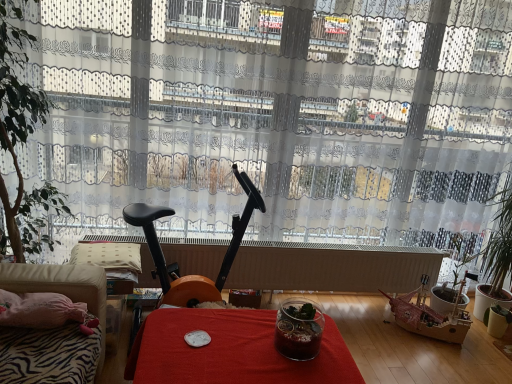
Where is `black plastic exercise bike at center`? black plastic exercise bike at center is located at coordinates (176, 263).

Locate an element on the screen. green leafy plant at right, which is the first houseplant from right to left is located at coordinates (455, 277).

The height and width of the screenshot is (384, 512). Describe the element at coordinates (16, 114) in the screenshot. I see `green leafy plant at left, acting as the first houseplant starting from the top` at that location.

Describe the element at coordinates (231, 351) in the screenshot. I see `red fabric table at center` at that location.

What do you see at coordinates (298, 329) in the screenshot?
I see `transparent glass jar at center` at bounding box center [298, 329].

What are the coordinates of `black plastic exercise bike at center` in the screenshot? It's located at (176, 263).

Which of these two, black plastic exercise bike at center or green leafy plant at left, acting as the first houseplant starting from the top, stands shorter?

black plastic exercise bike at center is shorter.

Is black plastic exercise bike at center positioned before green leafy plant at left, which is the 1th houseplant in left-to-right order?

No, black plastic exercise bike at center is further to the viewer.

From a real-world perspective, does black plastic exercise bike at center sit lower than green leafy plant at left, acting as the first houseplant starting from the top?

Yes, from a real-world perspective, black plastic exercise bike at center is below green leafy plant at left, acting as the first houseplant starting from the top.

How different are the orientations of black plastic exercise bike at center and green leafy plant at left, which is the 1th houseplant in front-to-back order, in degrees?

There is a 1.43-degree angle between the facing directions of black plastic exercise bike at center and green leafy plant at left, which is the 1th houseplant in front-to-back order.

Would you say transparent glass jar at center is to the left or to the right of green leafy plant at right, the 2th houseplant viewed from the front, in the picture?

In the image, transparent glass jar at center appears on the left side of green leafy plant at right, the 2th houseplant viewed from the front.

Can you tell me how much transparent glass jar at center and green leafy plant at right, the 2th houseplant viewed from the front, differ in facing direction?

There is a 0.0573-degree angle between the facing directions of transparent glass jar at center and green leafy plant at right, the 2th houseplant viewed from the front.

From a real-world perspective, which object stands above the other?

transparent glass jar at center, from a real-world perspective.

From the image's perspective, which object appears higher, transparent glass jar at center or green leafy plant at right, the 2th houseplant viewed from the front?

transparent glass jar at center, from the image's perspective.

Locate an element on the screen. The image size is (512, 384). studio couch on the left of transparent glass jar at center is located at coordinates (61, 286).

Considering the sizes of transparent glass jar at center and velvet beige couch at lower left in the image, is transparent glass jar at center taller or shorter than velvet beige couch at lower left?

Considering their sizes, transparent glass jar at center has less height than velvet beige couch at lower left.

Relative to velvet beige couch at lower left, is transparent glass jar at center in front or behind?

transparent glass jar at center is behind velvet beige couch at lower left.

Is transparent glass jar at center touching velvet beige couch at lower left?

No, transparent glass jar at center is not next to velvet beige couch at lower left.

Is velvet beige couch at lower left beside transparent glass jar at center?

No, velvet beige couch at lower left is not beside transparent glass jar at center.

From the image's perspective, between velvet beige couch at lower left and transparent glass jar at center, who is located below?

transparent glass jar at center is shown below in the image.

Find the location of a particular element. studio couch below the transparent glass jar at center (from a real-world perspective) is located at coordinates (61, 286).

Is velvet beige couch at lower left oriented away from transparent glass jar at center?

No, velvet beige couch at lower left's orientation is not away from transparent glass jar at center.

Based on the photo, how different are the orientations of red fabric table at center and velvet beige couch at lower left in degrees?

89.8 degrees separate the facing orientations of red fabric table at center and velvet beige couch at lower left.

Which is closer to the camera, (270, 379) or (37, 273)?

Positioned in front is point (270, 379).

Can you confirm if red fabric table at center is positioned to the right of velvet beige couch at lower left?

Yes, red fabric table at center is to the right of velvet beige couch at lower left.

Could you tell me if red fabric table at center is facing velvet beige couch at lower left?

No, red fabric table at center does not turn towards velvet beige couch at lower left.

Which is more to the left, green leafy plant at left, which is counted as the second houseplant, starting from the bottom, or green leafy plant at right, positioned as the 2th houseplant in top-to-bottom order?

From the viewer's perspective, green leafy plant at left, which is counted as the second houseplant, starting from the bottom, appears more on the left side.

From the image's perspective, is green leafy plant at left, which is counted as the second houseplant, starting from the bottom, above or below green leafy plant at right, the 2th houseplant viewed from the left?

green leafy plant at left, which is counted as the second houseplant, starting from the bottom, is above green leafy plant at right, the 2th houseplant viewed from the left.

From the picture: Does green leafy plant at left, acting as the first houseplant starting from the top, touch green leafy plant at right, the 2th houseplant viewed from the front?

green leafy plant at left, acting as the first houseplant starting from the top, and green leafy plant at right, the 2th houseplant viewed from the front, are not in contact.

Where is `houseplant behind the green leafy plant at left, which is the 1th houseplant in front-to-back order`? houseplant behind the green leafy plant at left, which is the 1th houseplant in front-to-back order is located at coordinates (455, 277).

From the image's perspective, would you say white matte radiator at center is positioned over green leafy plant at left, acting as the first houseplant starting from the top?

No, from the image's perspective, white matte radiator at center is not over green leafy plant at left, acting as the first houseplant starting from the top.

Is white matte radiator at center facing towards green leafy plant at left, the 2th houseplant in the right-to-left sequence?

No, white matte radiator at center is not facing towards green leafy plant at left, the 2th houseplant in the right-to-left sequence.

Based on the photo, considering the relative sizes of white matte radiator at center and green leafy plant at left, which is the 1th houseplant in front-to-back order, in the image provided, is white matte radiator at center shorter than green leafy plant at left, which is the 1th houseplant in front-to-back order,?

Correct, white matte radiator at center is not as tall as green leafy plant at left, which is the 1th houseplant in front-to-back order.

Where is `swivel chair on the right of green leafy plant at left, acting as the first houseplant starting from the top`? This screenshot has width=512, height=384. swivel chair on the right of green leafy plant at left, acting as the first houseplant starting from the top is located at coordinates (176, 263).

Image resolution: width=512 pixels, height=384 pixels. What are the coordinates of `houseplant below the transparent glass jar at center (from a real-world perspective)` in the screenshot? It's located at (455, 277).

Based on their spatial positions, is green leafy plant at right, the first houseplant ordered from the bottom, or black plastic exercise bike at center closer to red fabric table at center?

black plastic exercise bike at center is positioned closer to the anchor red fabric table at center.

From the image, which object appears to be farther from red fabric table at center, black plastic exercise bike at center or velvet beige couch at lower left?

black plastic exercise bike at center lies further to red fabric table at center than the other object.

Based on the photo, which object lies nearer to the anchor point transparent glass jar at center, red fabric table at center or velvet beige couch at lower left?

red fabric table at center lies closer to transparent glass jar at center than the other object.

When comparing their distances from red fabric table at center, does transparent glass jar at center or white matte radiator at center seem further?

Based on the image, white matte radiator at center appears to be further to red fabric table at center.

Based on their spatial positions, is transparent glass jar at center or velvet beige couch at lower left closer to white matte radiator at center?

Among the two, velvet beige couch at lower left is located nearer to white matte radiator at center.

From the image, which object appears to be farther from green leafy plant at right, positioned as the 2th houseplant in top-to-bottom order, white matte radiator at center or black plastic exercise bike at center?

Based on the image, black plastic exercise bike at center appears to be further to green leafy plant at right, positioned as the 2th houseplant in top-to-bottom order.

When comparing their distances from white matte radiator at center, does transparent glass jar at center or black plastic exercise bike at center seem further?

Among the two, transparent glass jar at center is located further to white matte radiator at center.

Considering their positions, is green leafy plant at left, the 2th houseplant in the right-to-left sequence, positioned further to red fabric table at center than green leafy plant at right, which is the first houseplant from right to left?

green leafy plant at right, which is the first houseplant from right to left, is further to red fabric table at center.

At what (x,y) coordinates should I click in order to perform the action: click on studio couch situated between green leafy plant at left, which is counted as the second houseplant, starting from the bottom, and red fabric table at center from left to right. Please return your answer as a coordinate pair (x, y). Looking at the image, I should click on (61, 286).

The width and height of the screenshot is (512, 384). What are the coordinates of `swivel chair situated between green leafy plant at left, which is the 1th houseplant in left-to-right order, and green leafy plant at right, the first houseplant viewed from the back, from left to right` in the screenshot? It's located at (176, 263).

Locate an element on the screen. Image resolution: width=512 pixels, height=384 pixels. glass jar between green leafy plant at left, acting as the first houseplant starting from the top, and green leafy plant at right, the first houseplant ordered from the bottom, in the horizontal direction is located at coordinates (298, 329).

Find the location of `swivel chair situated between green leafy plant at left, the 2th houseplant in the back-to-front sequence, and red fabric table at center from left to right`. swivel chair situated between green leafy plant at left, the 2th houseplant in the back-to-front sequence, and red fabric table at center from left to right is located at coordinates (176, 263).